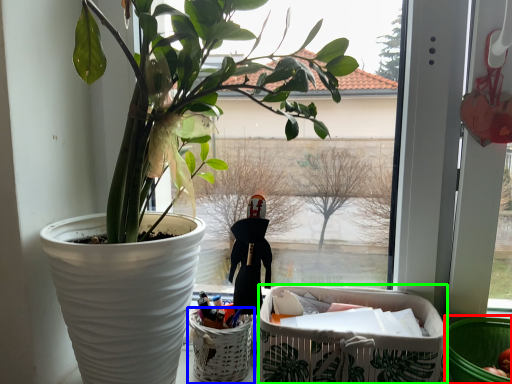
Question: Which object is the closest to the basket container (highlighted by a red box)? Choose among these: basket (highlighted by a blue box) or shopping basket (highlighted by a green box).

Choices:
 (A) basket
 (B) shopping basket

Answer: (B)